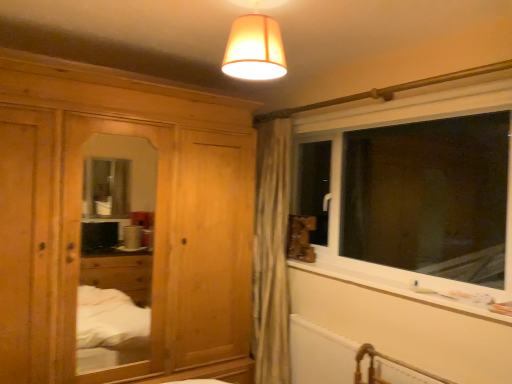
Identify the location of blank space situated above white matte radiator at lower right (from a real-world perspective). This screenshot has height=384, width=512. (375, 347).